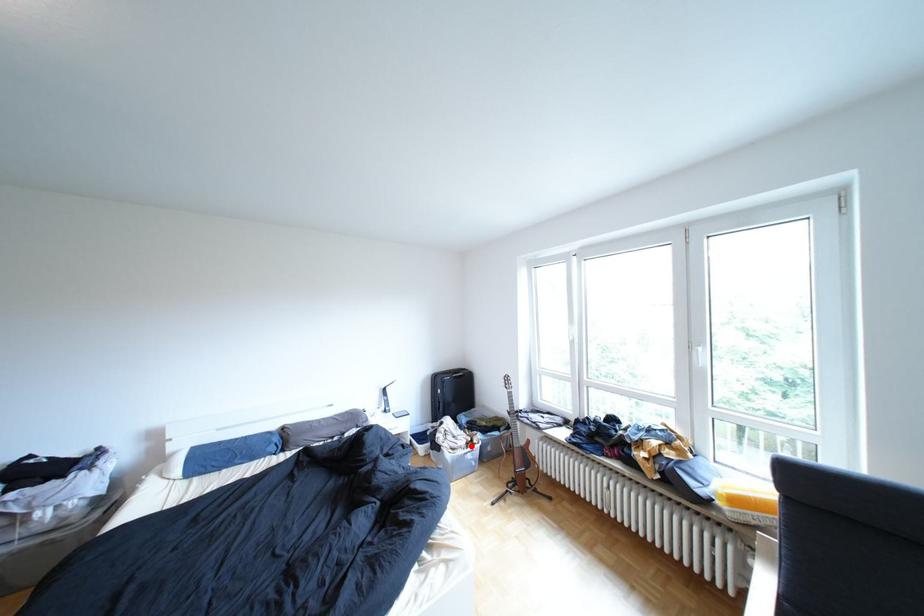
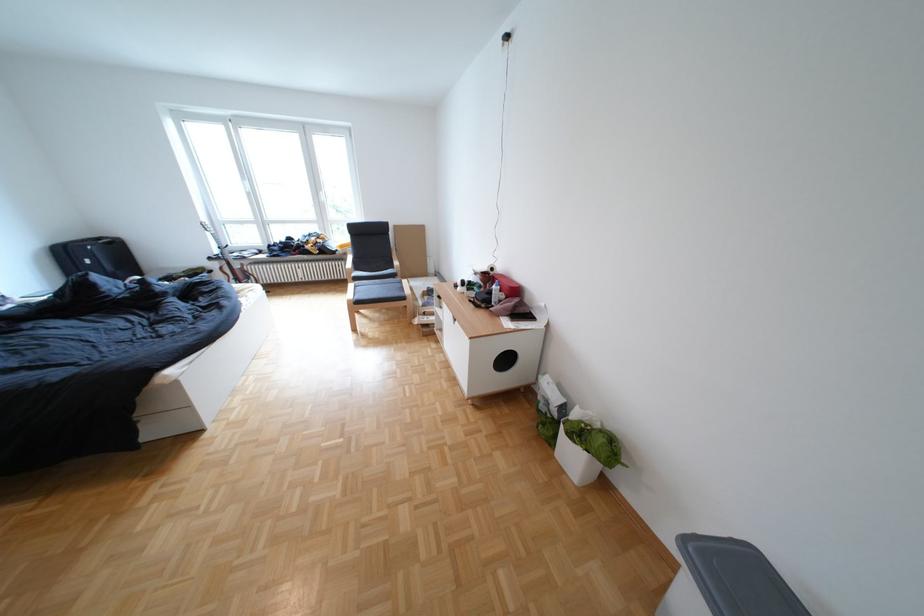
Question: I am providing you with two images of the same scene from different viewpoints. A red point is marked on the first image. At the location where the point appears in image 1, is it still visible in image 2?

Choices:
 (A) Yes
 (B) No

Answer: (B)